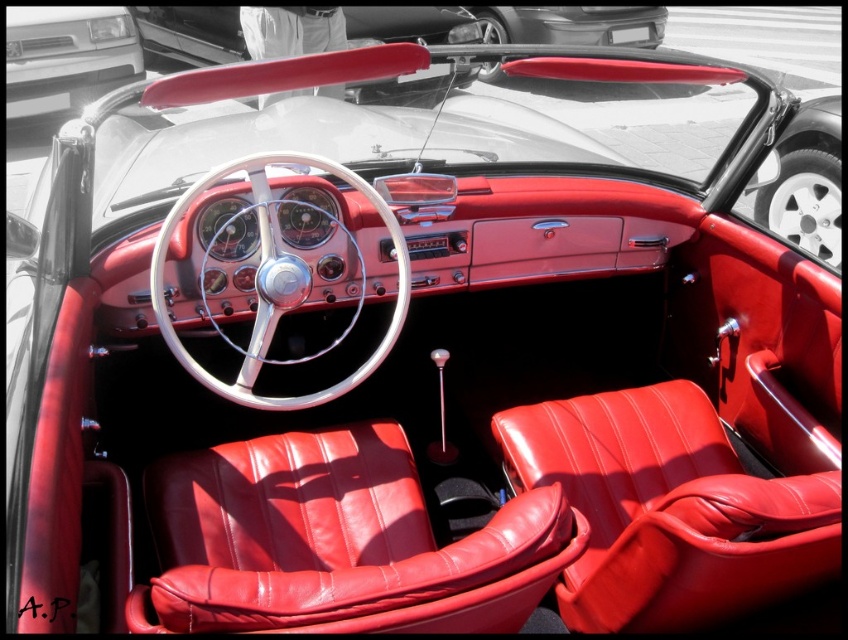
Between leather seat at center and shiny leather seat at center, which one is positioned higher?

Positioned higher is shiny leather seat at center.

Does leather seat at center lie behind shiny leather seat at center?

That is True.

Is point (565, 518) closer to camera compared to point (595, 448)?

Yes.

Where is `leather seat at center`? leather seat at center is located at coordinates (336, 541).

Between point (646, 547) and point (53, 104), which one is positioned in front?

Point (646, 547) is more forward.

Who is taller, shiny leather seat at center or matte silver bumper at upper left?

matte silver bumper at upper left is taller.

Find the location of `shiny leather seat at center`. shiny leather seat at center is located at coordinates (668, 509).

Can you confirm if polished chrome steering wheel at center is smaller than matte silver bumper at upper left?

Indeed, polished chrome steering wheel at center has a smaller size compared to matte silver bumper at upper left.

How far apart are polished chrome steering wheel at center and matte silver bumper at upper left?

polished chrome steering wheel at center and matte silver bumper at upper left are 4.02 meters apart.

Is point (246, 358) positioned behind point (46, 36)?

No.

Where is `polished chrome steering wheel at center`? The image size is (848, 640). polished chrome steering wheel at center is located at coordinates (275, 282).